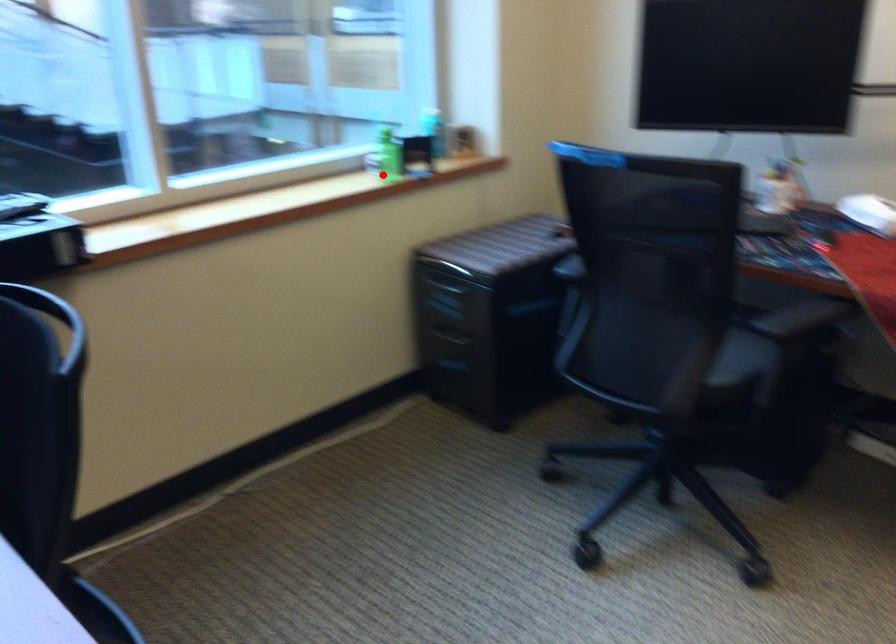
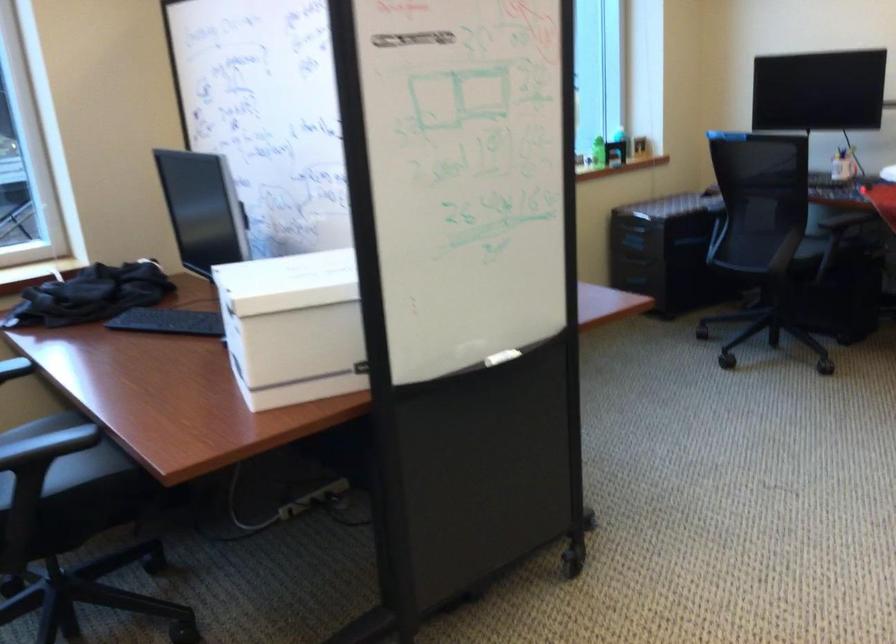
In the second image, find the point that corresponds to the highlighted location in the first image.

(598, 152)